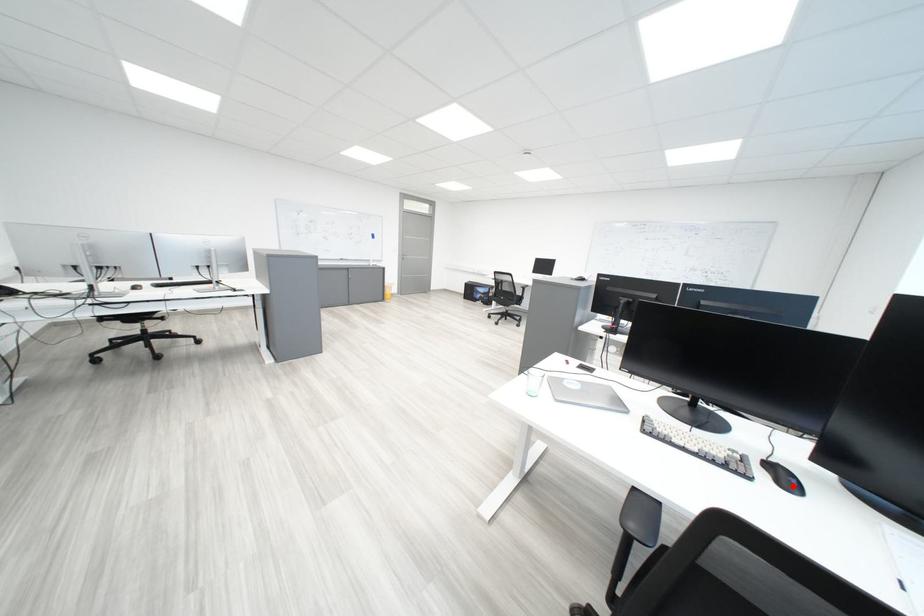
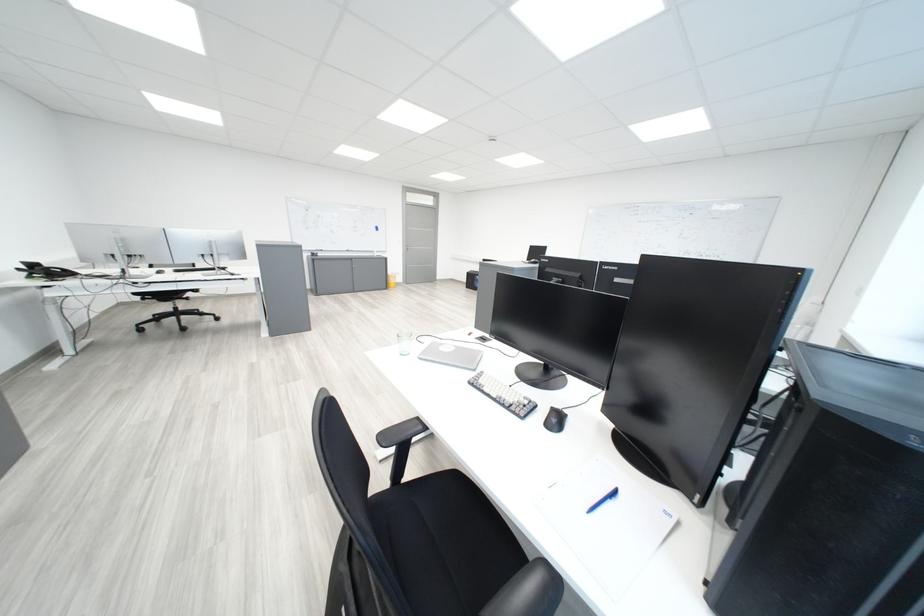
In the second image, find the point that corresponds to the highlighted location in the first image.

(562, 426)